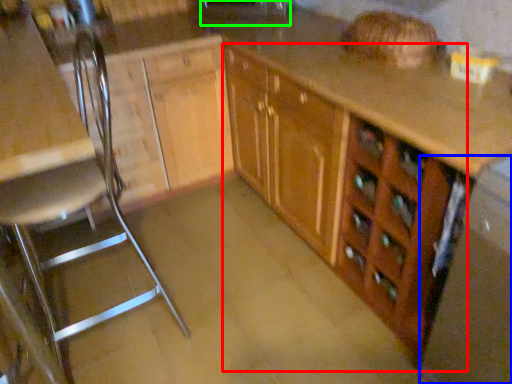
Question: Considering the real-world distances, which object is closest to cabinetry (highlighted by a red box)? appliance (highlighted by a blue box) or sink (highlighted by a green box).

Choices:
 (A) appliance
 (B) sink

Answer: (A)